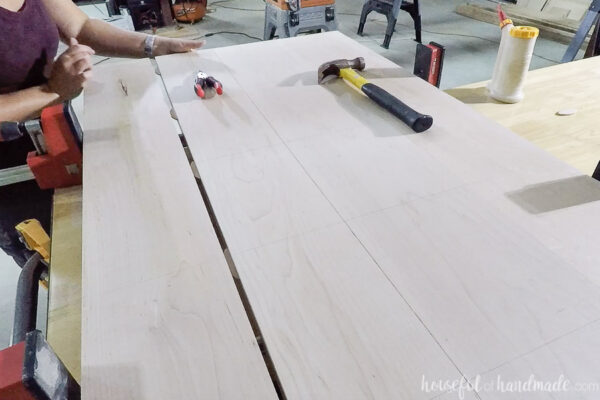
The image size is (600, 400). What are the coordinates of `empty space on work bench` in the screenshot? It's located at (533, 125).